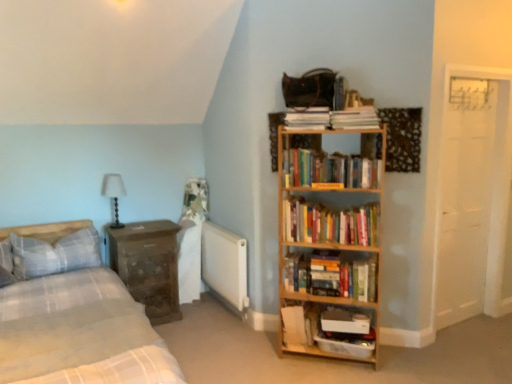
Locate an element on the screen. blank space above white matte radiator at center (from a real-world perspective) is located at coordinates (220, 232).